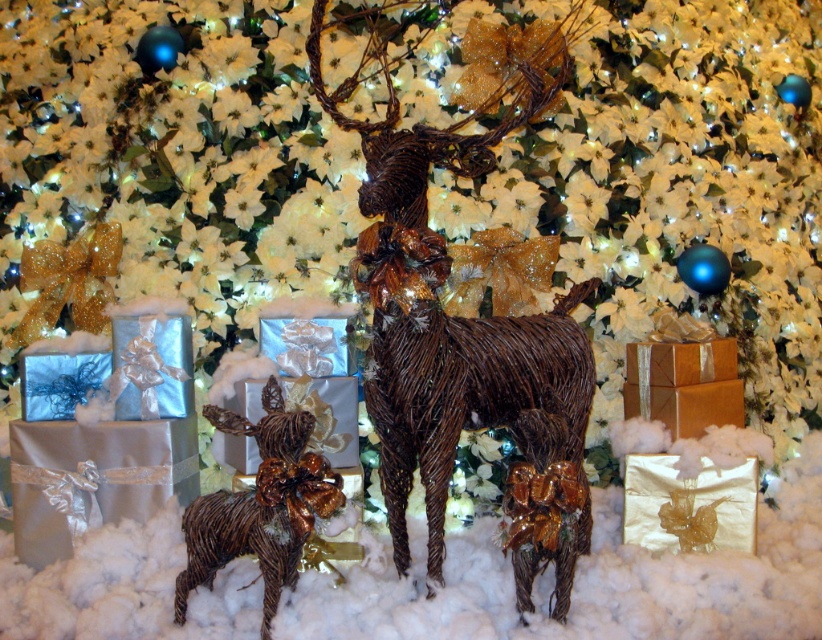
Question: Among these points, which one is nearest to the camera?

Choices:
 (A) (176, 595)
 (B) (418, 317)

Answer: (B)

Question: Which point is closer to the camera?

Choices:
 (A) shiny gold figurine at lower left
 (B) brown textured reindeer at center

Answer: (B)

Question: From the image, what is the correct spatial relationship of brown textured reindeer at center in relation to shiny gold figurine at lower left?

Choices:
 (A) left
 (B) right

Answer: (B)

Question: Is brown textured reindeer at center wider than shiny gold figurine at lower left?

Choices:
 (A) no
 (B) yes

Answer: (B)

Question: Does brown textured reindeer at center have a lesser width compared to shiny gold figurine at lower left?

Choices:
 (A) no
 (B) yes

Answer: (A)